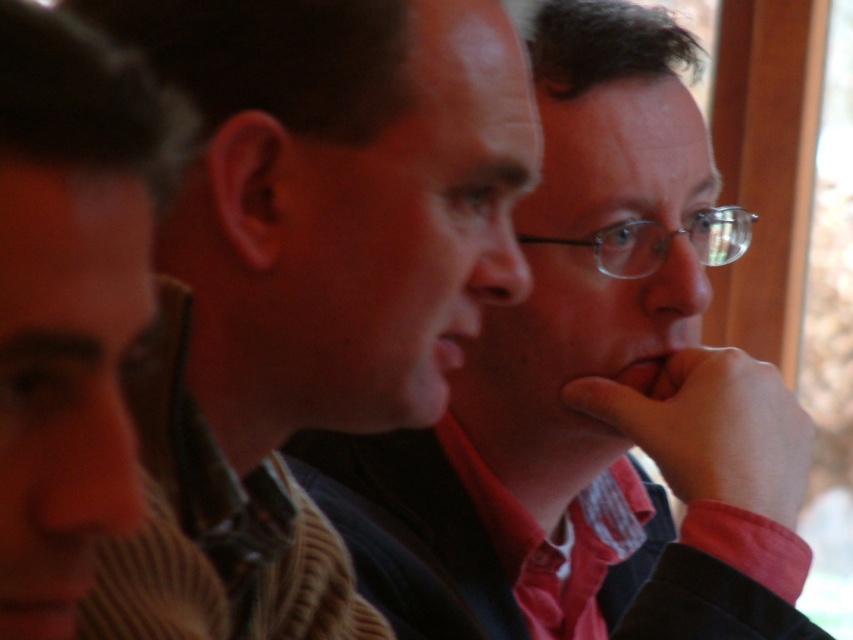
You are standing in front of the image and want to touch the point that is closer to you. Which point should you choose between point (300, 52) and point (15, 252)?

Point (15, 252) is closer to you than point (300, 52), so you should choose point (15, 252).

You are a photographer trying to capture a clear shot of both the matte black shirt at center and the brown striped sweater at left. Since you can only focus on one subject at a time, which one should you choose to ensure the other remains somewhat in focus?

You should focus on the matte black shirt at center because it is closer to you than the brown striped sweater at left, so focusing on the closer subject will keep the background subject somewhat in focus.